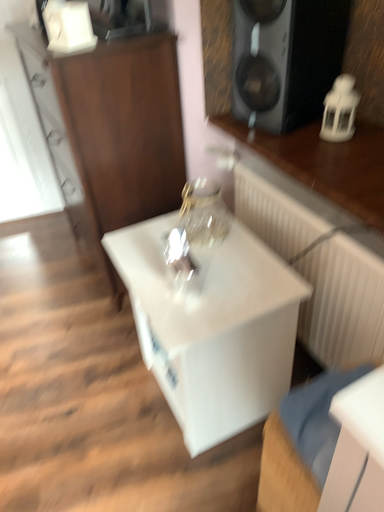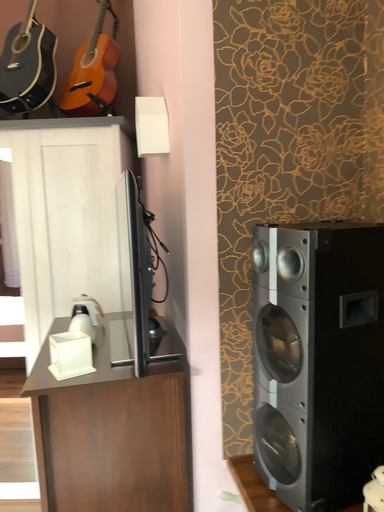
Question: Which way did the camera rotate in the video?

Choices:
 (A) rotated downward
 (B) rotated upward

Answer: (B)